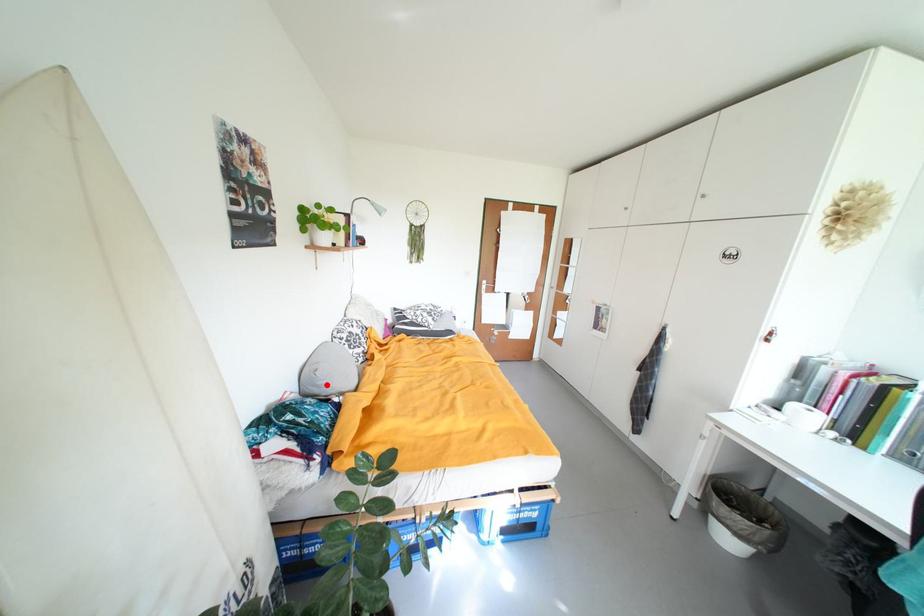
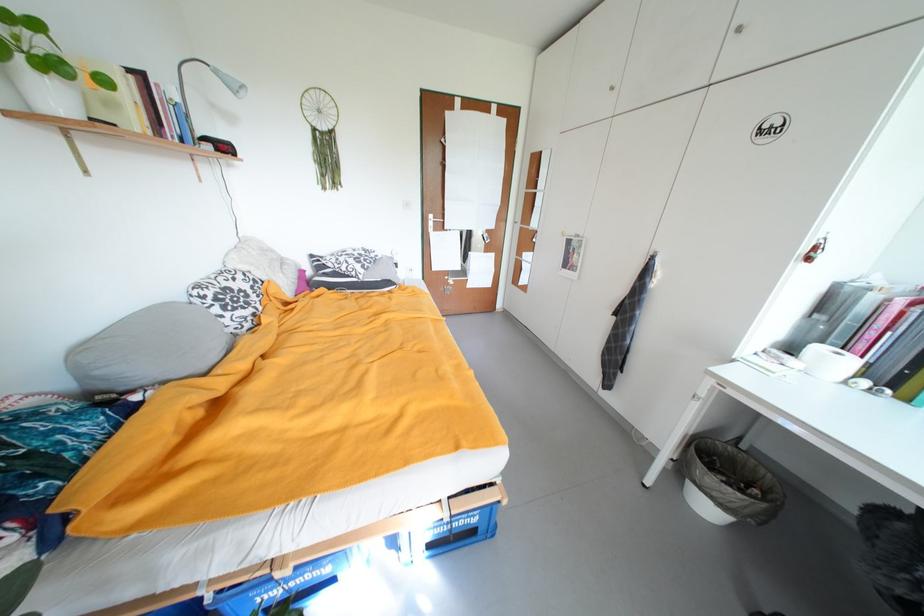
Find the pixel in the second image that matches the highlighted location in the first image.

(105, 374)